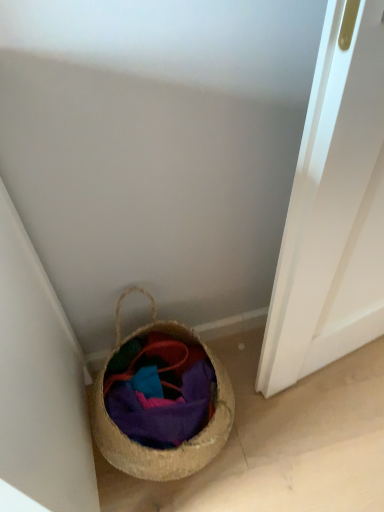
Question: In terms of width, does woven straw basket at lower left look wider or thinner when compared to multicolored woven basket at lower left?

Choices:
 (A) thin
 (B) wide

Answer: (B)

Question: From a real-world perspective, is woven straw basket at lower left above or below multicolored woven basket at lower left?

Choices:
 (A) below
 (B) above

Answer: (B)

Question: Is woven straw basket at lower left in front of or behind multicolored woven basket at lower left in the image?

Choices:
 (A) front
 (B) behind

Answer: (A)

Question: From the image's perspective, relative to woven straw basket at lower left, is multicolored woven basket at lower left above or below?

Choices:
 (A) above
 (B) below

Answer: (B)

Question: Based on their sizes in the image, would you say multicolored woven basket at lower left is bigger or smaller than woven straw basket at lower left?

Choices:
 (A) small
 (B) big

Answer: (A)

Question: From a real-world perspective, relative to woven straw basket at lower left, is multicolored woven basket at lower left vertically above or below?

Choices:
 (A) below
 (B) above

Answer: (A)

Question: In the image, is multicolored woven basket at lower left positioned in front of or behind woven straw basket at lower left?

Choices:
 (A) behind
 (B) front

Answer: (A)